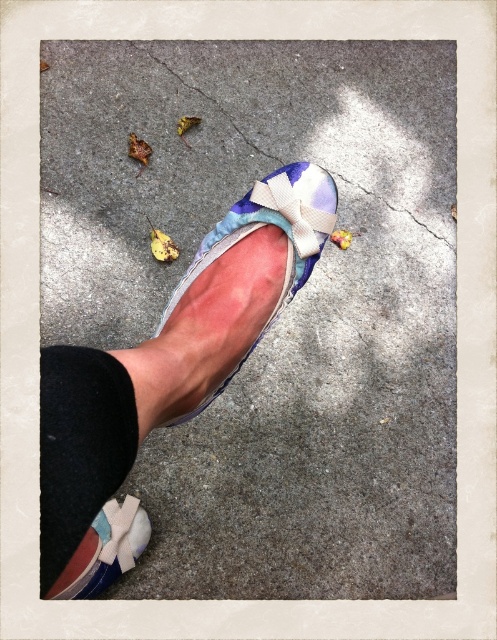
Question: Estimate the real-world distances between objects in this image. Which object is farther from the cracked concrete at center?

Choices:
 (A) gray concrete sidewalk at center
 (B) black fabric ankle at lower left
 (C) matte floral shoe at center

Answer: (B)

Question: Does gray concrete sidewalk at center have a lesser width compared to matte fabric shoe at lower left?

Choices:
 (A) no
 (B) yes

Answer: (A)

Question: Which point is farther to the camera?

Choices:
 (A) black fabric ankle at lower left
 (B) cracked concrete at center

Answer: (B)

Question: Can you confirm if cracked concrete at center is wider than black fabric ankle at lower left?

Choices:
 (A) yes
 (B) no

Answer: (A)

Question: Can you confirm if cracked concrete at center is positioned to the left of matte floral shoe at center?

Choices:
 (A) yes
 (B) no

Answer: (B)

Question: Which object is the farthest from the matte floral shoe at center?

Choices:
 (A) cracked concrete at center
 (B) matte fabric shoe at lower left
 (C) gray concrete sidewalk at center
 (D) black fabric ankle at lower left

Answer: (B)